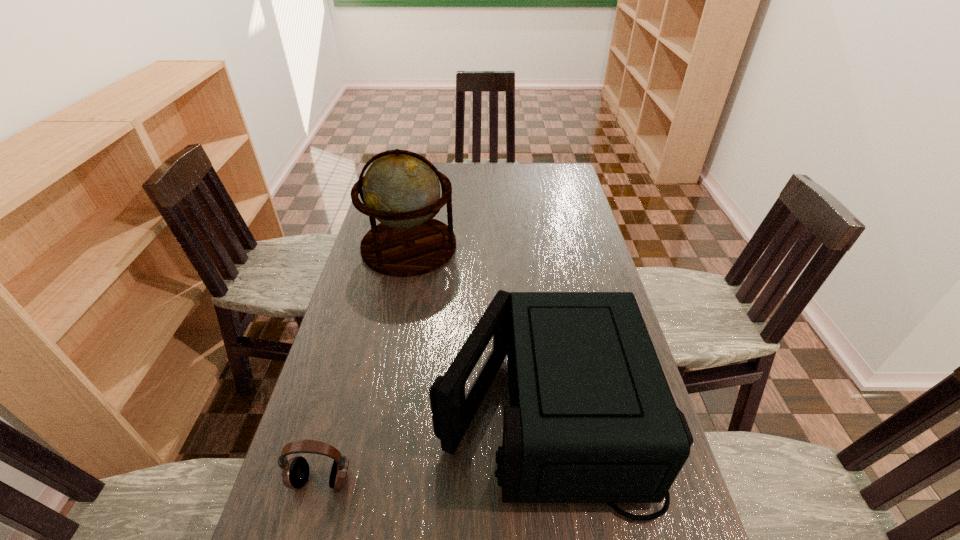
Image resolution: width=960 pixels, height=540 pixels. In order to click on the tallest object in this screenshot , I will do (x=401, y=189).

I want to click on the farthest object, so [401, 189].

Locate an element on the screen. the second shortest object is located at coordinates (592, 419).

The width and height of the screenshot is (960, 540). I want to click on the shortest object, so click(x=295, y=472).

The height and width of the screenshot is (540, 960). In order to click on vacant space situated 0.200m on the front-facing side of the farthest object in this screenshot , I will do `click(513, 246)`.

The width and height of the screenshot is (960, 540). What are the coordinates of `vacant region located with the door open on the microwave oven` in the screenshot? It's located at (319, 409).

The image size is (960, 540). Find the location of `vacant point located with the door open on the microwave oven`. vacant point located with the door open on the microwave oven is located at coordinates (356, 409).

The height and width of the screenshot is (540, 960). Identify the location of vacant space located 0.250m with the door open on the microwave oven. (335, 409).

At what (x,y) coordinates should I click in order to perform the action: click on free location located 0.080m on the ear pads of the headset. Please return your answer as a coordinate pair (x, y). This screenshot has height=540, width=960. Looking at the image, I should click on (305, 537).

You are a GUI agent. You are given a task and a screenshot of the screen. Output one action in this format:
    pyautogui.click(x=<x>, y=<y>)
    Task: Click on the globe that is at the left edge
    Image resolution: width=960 pixels, height=540 pixels.
    Given the screenshot: What is the action you would take?
    pyautogui.click(x=401, y=189)